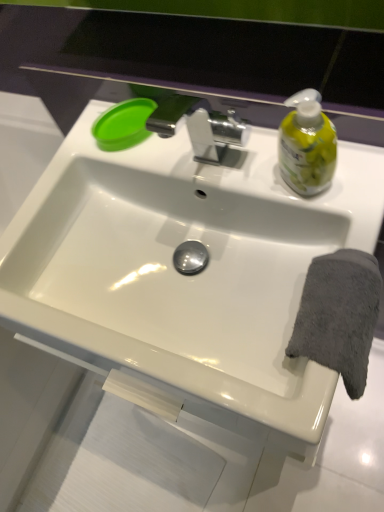
The image size is (384, 512). What do you see at coordinates (178, 273) in the screenshot?
I see `white glossy sink at center` at bounding box center [178, 273].

What is the approximate height of green plastic lid at upper left?

The height of green plastic lid at upper left is 3.25 centimeters.

Locate an element on the screen. The width and height of the screenshot is (384, 512). green plastic lid at upper left is located at coordinates pos(123,124).

Identify the location of white glossy sink at center. (178, 273).

Based on the photo, would you say gray soft towel at right contains white glossy sink at center?

No, white glossy sink at center is not surrounded by gray soft towel at right.

Which is further, (316, 284) or (292, 246)?

Point (292, 246)

Identify the location of sink above the gray soft towel at right (from the image's perspective). The image size is (384, 512). (178, 273).

Are green plastic lid at upper left and white glossy sink at center beside each other?

green plastic lid at upper left is not next to white glossy sink at center, and they're not touching.

Considering the positions of objects green plastic lid at upper left and white glossy sink at center in the image provided, who is more to the left, green plastic lid at upper left or white glossy sink at center?

From the viewer's perspective, green plastic lid at upper left appears more on the left side.

From the image's perspective, which is below, green plastic lid at upper left or white glossy sink at center?

white glossy sink at center is shown below in the image.

Considering the positions of objects green plastic lid at upper left and white glossy sink at center in the image provided, who is in front, green plastic lid at upper left or white glossy sink at center?

Positioned in front is white glossy sink at center.

From the image's perspective, who appears lower, white glossy sink at center or gray soft towel at right?

From the image's view, gray soft towel at right is below.

Can you tell me how much white glossy sink at center and gray soft towel at right differ in facing direction?

The angle between the facing direction of white glossy sink at center and the facing direction of gray soft towel at right is 90 degrees.

Considering the positions of objects white glossy sink at center and gray soft towel at right in the image provided, who is in front, white glossy sink at center or gray soft towel at right?

white glossy sink at center is closer to the camera.

Where is `soap above the gray soft towel at right (from a real-world perspective)`? This screenshot has width=384, height=512. soap above the gray soft towel at right (from a real-world perspective) is located at coordinates (123, 124).

Is gray soft towel at right thinner than green plastic lid at upper left?

In fact, gray soft towel at right might be wider than green plastic lid at upper left.

Does gray soft towel at right contain green plastic lid at upper left?

That's incorrect, green plastic lid at upper left is not inside gray soft towel at right.

From the image's perspective, would you say gray soft towel at right is shown under green plastic lid at upper left?

Indeed, from the image's perspective, gray soft towel at right is shown beneath green plastic lid at upper left.

Consider the image. Which object is thinner, white glossy sink at center or green plastic lid at upper left?

green plastic lid at upper left.

From the picture: Considering their positions, is white glossy sink at center located in front of or behind green plastic lid at upper left?

Clearly, white glossy sink at center is in front of green plastic lid at upper left.

Consider the image. From a real-world perspective, who is located lower, white glossy sink at center or green plastic lid at upper left?

white glossy sink at center.

There is a white glossy sink at center. At what (x,y) coordinates should I click in order to perform the action: click on soap above it (from a real-world perspective). Please return your answer as a coordinate pair (x, y). This screenshot has height=512, width=384. Looking at the image, I should click on (123, 124).

From the image's perspective, is green plastic lid at upper left positioned above or below gray soft towel at right?

Based on their image positions, green plastic lid at upper left is located above gray soft towel at right.

Looking at the image, does green plastic lid at upper left seem bigger or smaller compared to gray soft towel at right?

Clearly, green plastic lid at upper left is smaller in size than gray soft towel at right.

Could you tell me if green plastic lid at upper left is turned towards gray soft towel at right?

Yes.

Considering the relative sizes of green plastic lid at upper left and gray soft towel at right in the image provided, is green plastic lid at upper left shorter than gray soft towel at right?

Yes.

What are the coordinates of `bath towel behind the white glossy sink at center` in the screenshot? It's located at (339, 315).

This screenshot has width=384, height=512. Find the location of `soap on the left of white glossy sink at center`. soap on the left of white glossy sink at center is located at coordinates (123, 124).

Considering their positions, is green plastic lid at upper left positioned further to white glossy sink at center than gray soft towel at right?

green plastic lid at upper left is positioned further to the anchor white glossy sink at center.

Based on their spatial positions, is green plastic lid at upper left or white glossy sink at center closer to gray soft towel at right?

Among the two, white glossy sink at center is located nearer to gray soft towel at right.

From the image, which object appears to be farther from green plastic lid at upper left, gray soft towel at right or white glossy sink at center?

gray soft towel at right is positioned further to the anchor green plastic lid at upper left.

Considering their positions, is gray soft towel at right positioned closer to white glossy sink at center than green plastic lid at upper left?

gray soft towel at right is closer to white glossy sink at center.

From the image, which object appears to be farther from gray soft towel at right, white glossy sink at center or green plastic lid at upper left?

green plastic lid at upper left lies further to gray soft towel at right than the other object.

Which object lies further to the anchor point green plastic lid at upper left, white glossy sink at center or gray soft towel at right?

gray soft towel at right is positioned further to the anchor green plastic lid at upper left.

Find the location of `sink between green plastic lid at upper left and gray soft towel at right from top to bottom`. sink between green plastic lid at upper left and gray soft towel at right from top to bottom is located at coordinates (178, 273).